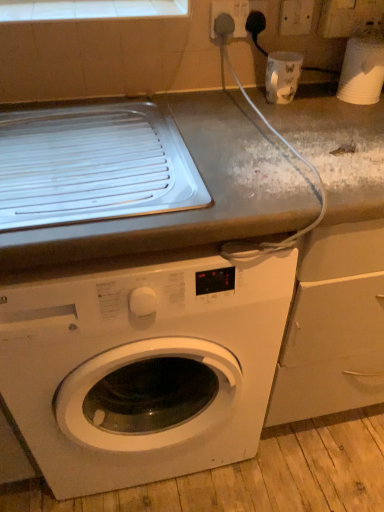
Question: Relative to white tile at upper center, is white plastic electric outlet at upper right, which is the 2th electric outlet in left-to-right order, in front or behind?

Choices:
 (A) front
 (B) behind

Answer: (B)

Question: Does point (286, 23) appear closer or farther from the camera than point (28, 19)?

Choices:
 (A) closer
 (B) farther

Answer: (B)

Question: Estimate the real-world distances between objects in this image. Which object is farther from the white plastic socket at upper right, marked as the first electric outlet in a left-to-right arrangement?

Choices:
 (A) white plastic cup at upper right, which appears as the first appliance when viewed from the right
 (B) white glossy cup at upper right, acting as the first appliance starting from the left
 (C) white tile at upper center
 (D) white plastic electric outlet at upper right, which is the 2th electric outlet in left-to-right order
 (E) white glossy washing machine at center

Answer: (E)

Question: Which of these objects is positioned closest to the white plastic electric outlet at upper right, which is the first electric outlet from right to left?

Choices:
 (A) white tile at upper center
 (B) white plastic cup at upper right, the 2th appliance in the left-to-right sequence
 (C) white glossy washing machine at center
 (D) white plastic socket at upper right, marked as the first electric outlet in a left-to-right arrangement
 (E) white glossy cup at upper right, arranged as the 2th appliance when viewed from the right

Answer: (E)